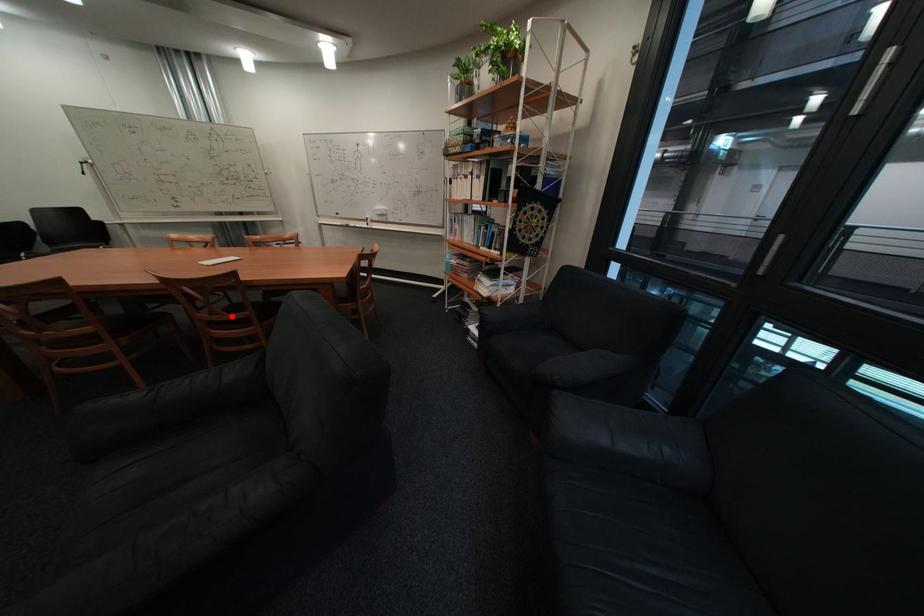
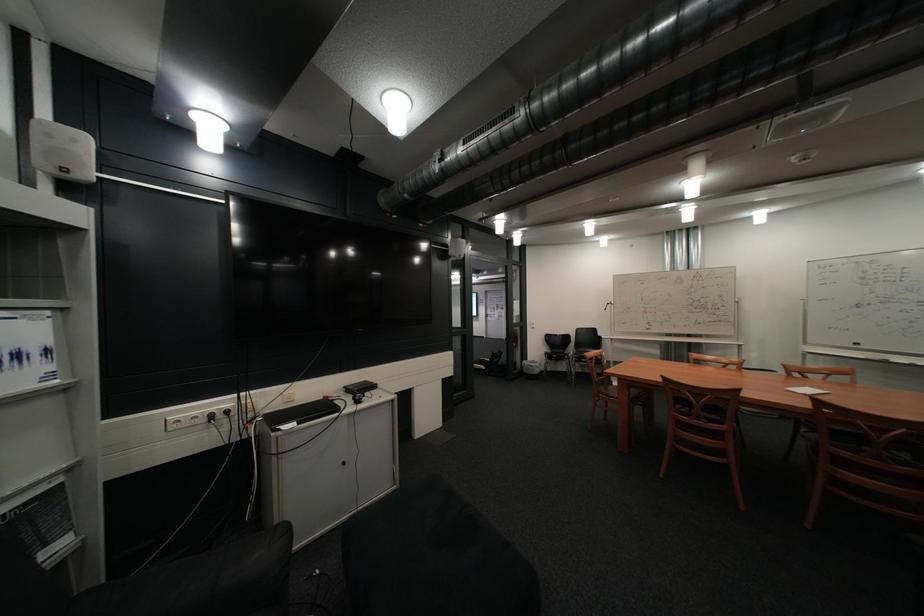
Locate, in the second image, the point that corresponds to the highlighted location in the first image.

(888, 460)